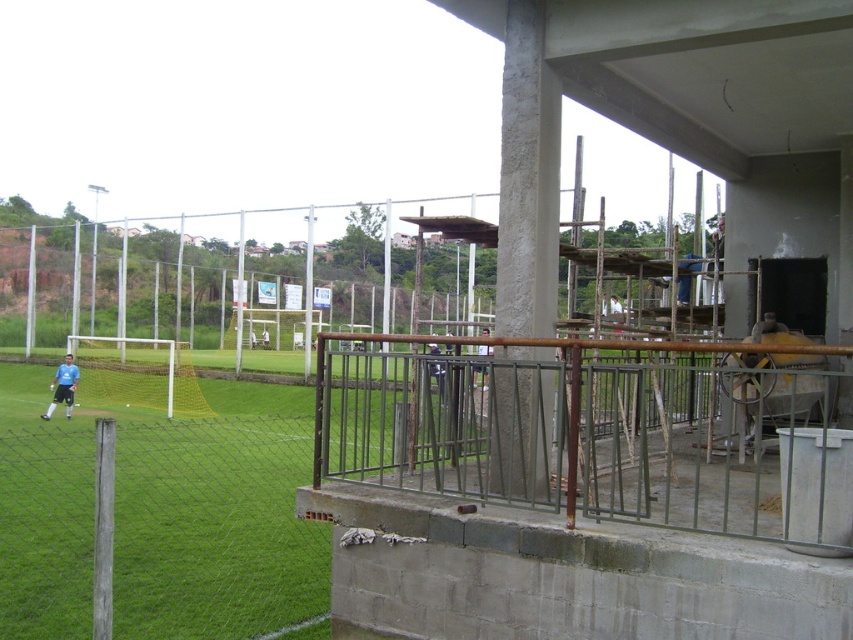
You are standing at the point with coordinates point (x=722, y=224) and want to walk to point (x=61, y=368). Given that you can only move forward and cannot turn, will you be able to reach the destination without deviating from your path?

Since point (x=722, y=224) is closer to the camera than point (x=61, y=368), you will not be able to reach the destination without deviating from your path because you are already closer to the camera and moving forward would take you away from the farther point.